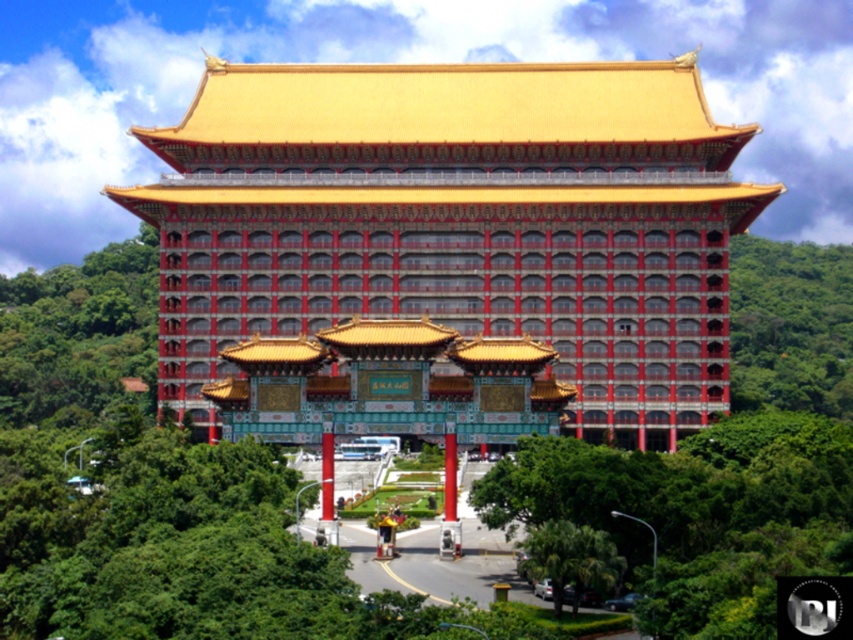
You are standing in front of the grand East Asian style building and notice two pillars at the center. Which pillar is closer to you, the red glossy pillar at center or the smooth red pillar at center?

The red glossy pillar at center is closer to you since it is positioned in front of the smooth red pillar at center.

You are a visitor approaching the entrance of the hotel. You notice the polished gold gate at center and the smooth red pillar at center. Which one do you see as taller from your perspective?

The polished gold gate at center is taller than the smooth red pillar at center, so you see the polished gold gate at center as taller.

You are standing at the entrance of the hotel and want to take a photo of the grand building. To ensure the green leafy tree at right is not blocking the view, should you position yourself to the left or right of the gateway?

You should position yourself to the left of the gateway. Since the green leafy tree at right is located at point (790, 324), moving to the left would place the tree out of the frame, ensuring an unobstructed view of the building.